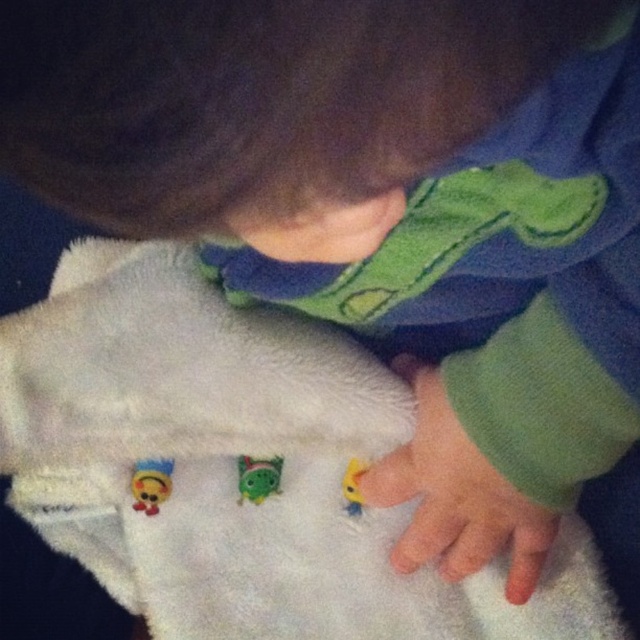
Question: Does smooth green hand at lower center come in front of green matte plush toy at center?

Choices:
 (A) no
 (B) yes

Answer: (B)

Question: Which point is farther to the camera?

Choices:
 (A) matte yellow plush at lower left
 (B) smooth green hand at lower center
 (C) white soft blanket at center

Answer: (A)

Question: Is smooth green hand at lower center to the left of green matte plush toy at center from the viewer's perspective?

Choices:
 (A) no
 (B) yes

Answer: (A)

Question: Is the position of smooth green hand at lower center less distant than that of green matte plush toy at center?

Choices:
 (A) yes
 (B) no

Answer: (A)

Question: Estimate the real-world distances between objects in this image. Which object is farther from the yellow matte toy at lower center?

Choices:
 (A) smooth green hand at lower center
 (B) matte yellow plush at lower left
 (C) white soft blanket at center

Answer: (B)

Question: Among these objects, which one is farthest from the camera?

Choices:
 (A) green matte plush toy at center
 (B) smooth green hand at lower center
 (C) matte yellow plush at lower left

Answer: (A)